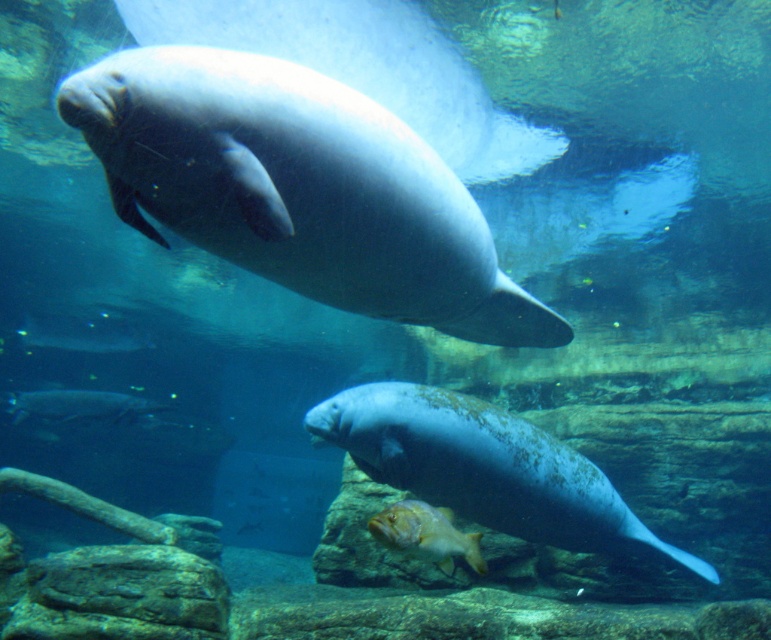
Which is above, speckled gray fish at lower center or shiny golden fish at lower center?

Positioned higher is speckled gray fish at lower center.

Does speckled gray fish at lower center appear on the right side of shiny golden fish at lower center?

Yes, speckled gray fish at lower center is to the right of shiny golden fish at lower center.

Which is in front, point (551, 493) or point (416, 547)?

Point (416, 547) is more forward.

Locate an element on the screen. The height and width of the screenshot is (640, 771). speckled gray fish at lower center is located at coordinates (487, 468).

Consider the image. Between shiny golden fish at lower center and silvery metallic fish at lower left, which one has less height?

shiny golden fish at lower center

Can you confirm if shiny golden fish at lower center is thinner than silvery metallic fish at lower left?

Yes, shiny golden fish at lower center is thinner than silvery metallic fish at lower left.

Describe the element at coordinates (426, 534) in the screenshot. I see `shiny golden fish at lower center` at that location.

Locate an element on the screen. shiny golden fish at lower center is located at coordinates (426, 534).

Which is in front, point (549, 312) or point (443, 490)?

Point (549, 312) is more forward.

Does smooth gray manatee at upper center have a greater height compared to speckled gray fish at lower center?

No.

Is point (160, 51) closer to camera compared to point (554, 456)?

That is True.

Locate an element on the screen. Image resolution: width=771 pixels, height=640 pixels. smooth gray manatee at upper center is located at coordinates (298, 188).